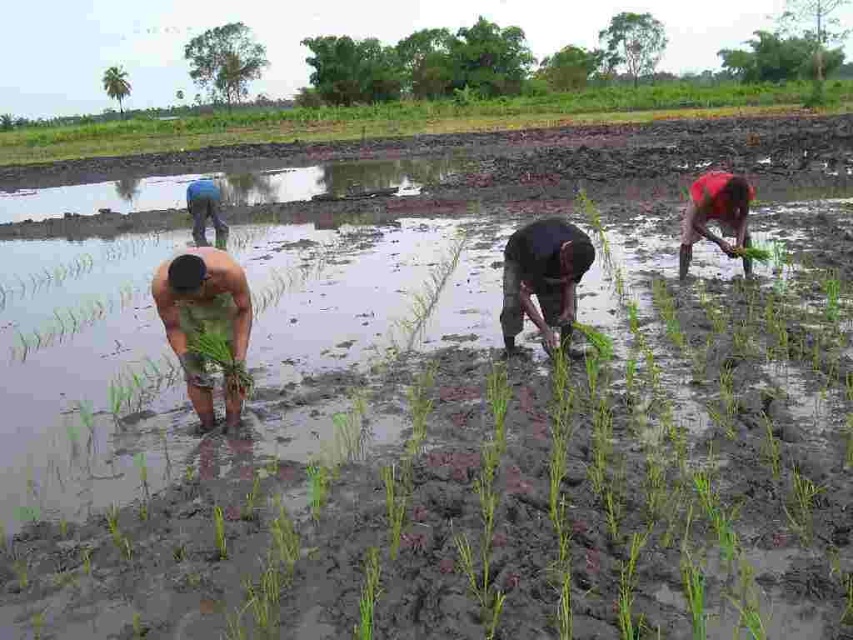
Between green leafy plant at center and dark brown skin at center, which one is positioned lower?

green leafy plant at center is below.

Does green leafy plant at center lie in front of dark brown skin at center?

Yes, it is in front of dark brown skin at center.

This screenshot has width=853, height=640. Find the location of `green leafy plant at center`. green leafy plant at center is located at coordinates (202, 314).

Between point (688, 246) and point (209, 204), which one is positioned behind?

Positioned behind is point (209, 204).

Does point (709, 232) lie behind point (218, 243)?

No, it is in front of (218, 243).

Where is `red matte shirt at right`? The image size is (853, 640). red matte shirt at right is located at coordinates (715, 212).

The height and width of the screenshot is (640, 853). What do you see at coordinates (543, 278) in the screenshot? I see `dark brown skin at center` at bounding box center [543, 278].

Does dark brown skin at center appear on the right side of red matte shirt at right?

No, dark brown skin at center is not to the right of red matte shirt at right.

Locate an element on the screen. dark brown skin at center is located at coordinates (543, 278).